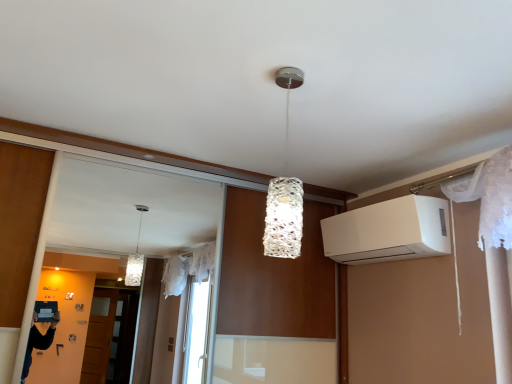
Question: Is white matte air conditioner at upper right positioned beyond the bounds of white textured lamp at center?

Choices:
 (A) yes
 (B) no

Answer: (A)

Question: Considering the relative positions of white matte air conditioner at upper right and white textured lamp at center in the image provided, is white matte air conditioner at upper right behind white textured lamp at center?

Choices:
 (A) no
 (B) yes

Answer: (B)

Question: Would you say white matte air conditioner at upper right contains white textured lamp at center?

Choices:
 (A) yes
 (B) no

Answer: (B)

Question: Could you tell me if white matte air conditioner at upper right is facing white textured lamp at center?

Choices:
 (A) yes
 (B) no

Answer: (A)

Question: Are white matte air conditioner at upper right and white textured lamp at center far apart?

Choices:
 (A) no
 (B) yes

Answer: (A)

Question: From the image's perspective, does white matte air conditioner at upper right appear lower than white textured lamp at center?

Choices:
 (A) no
 (B) yes

Answer: (B)

Question: From the image's perspective, is white textured lamp at center located beneath white matte air conditioner at upper right?

Choices:
 (A) no
 (B) yes

Answer: (A)

Question: Does white textured lamp at center appear on the right side of white matte air conditioner at upper right?

Choices:
 (A) no
 (B) yes

Answer: (A)

Question: Is white textured lamp at center thinner than white matte air conditioner at upper right?

Choices:
 (A) no
 (B) yes

Answer: (B)

Question: Does white textured lamp at center lie in front of white matte air conditioner at upper right?

Choices:
 (A) no
 (B) yes

Answer: (B)

Question: From a real-world perspective, is white textured lamp at center located higher than white matte air conditioner at upper right?

Choices:
 (A) yes
 (B) no

Answer: (A)

Question: Can you confirm if white textured lamp at center is smaller than white matte air conditioner at upper right?

Choices:
 (A) no
 (B) yes

Answer: (B)

Question: Looking at the image, does white textured lamp at center seem bigger or smaller compared to white matte air conditioner at upper right?

Choices:
 (A) big
 (B) small

Answer: (B)